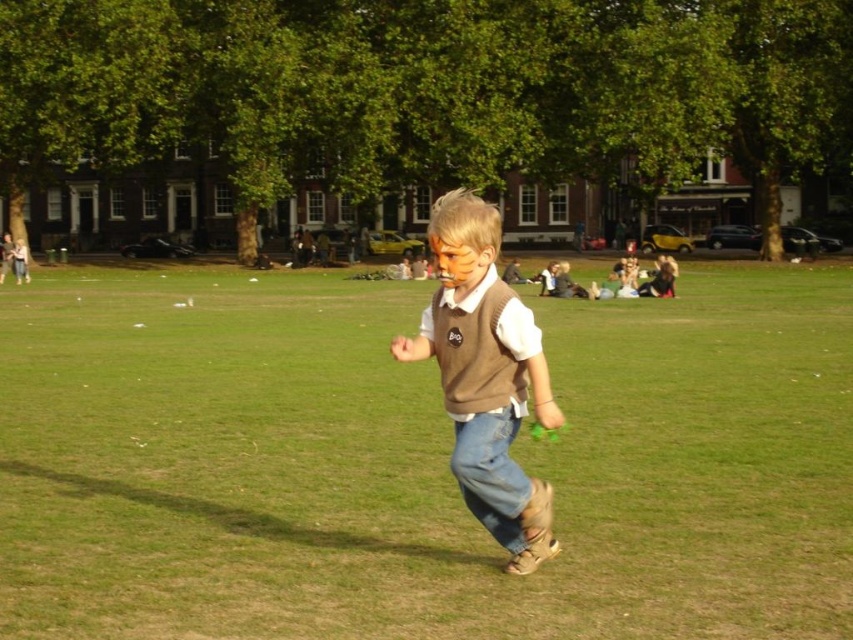
Question: Among these points, which one is farthest from the camera?

Choices:
 (A) (514, 528)
 (B) (430, 246)
 (C) (741, 550)

Answer: (B)

Question: Is brown suede vest at center below denim jeans at center?

Choices:
 (A) yes
 (B) no

Answer: (B)

Question: Is brown leather shoes at center smaller than denim jeans at center?

Choices:
 (A) yes
 (B) no

Answer: (B)

Question: Among these objects, which one is farthest from the camera?

Choices:
 (A) brown suede vest at center
 (B) brown leather shoes at center

Answer: (A)

Question: Is brown suede vest at center bigger than denim jeans at center?

Choices:
 (A) yes
 (B) no

Answer: (A)

Question: Which point is closer to the camera taking this photo?

Choices:
 (A) 509,493
 (B) 492,456

Answer: (B)